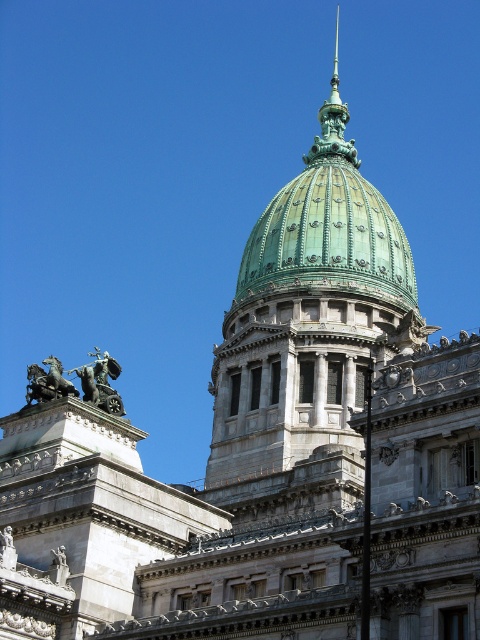
Does green polished dome at center appear over bronze statue at upper left?

Indeed, green polished dome at center is positioned over bronze statue at upper left.

Who is positioned more to the left, green polished dome at center or bronze statue at upper left?

From the viewer's perspective, bronze statue at upper left appears more on the left side.

Measure the distance between green polished dome at center and camera.

green polished dome at center and camera are 50.63 meters apart.

The image size is (480, 640). What are the coordinates of `green polished dome at center` in the screenshot? It's located at (308, 323).

Locate an element on the screen. green polished dome at center is located at coordinates (308, 323).

Does green polished dome at center come in front of green patina dome at center?

Yes, it is.

Does point (284, 404) come in front of point (251, 289)?

That is True.

Identify the location of green polished dome at center. The height and width of the screenshot is (640, 480). (308, 323).

Does green patina dome at center have a lesser height compared to bronze/golden statue of horses at upper left?

In fact, green patina dome at center may be taller than bronze/golden statue of horses at upper left.

Is green patina dome at center closer to the viewer compared to bronze/golden statue of horses at upper left?

No, it is not.

Which is behind, point (274, 250) or point (34, 371)?

The point (274, 250) is behind.

Find the location of a particular element. Image resolution: width=480 pixels, height=640 pixels. green patina dome at center is located at coordinates (328, 236).